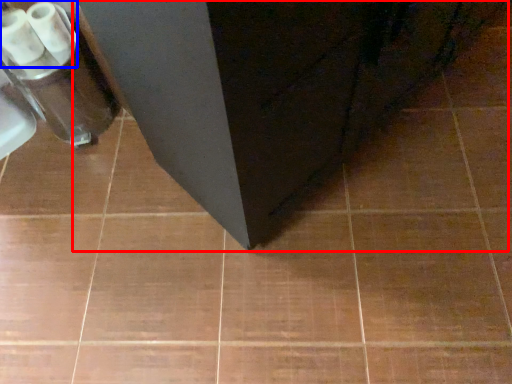
Question: Which object appears closest to the camera in this image, furniture (highlighted by a red box) or toilet paper (highlighted by a blue box)?

Choices:
 (A) furniture
 (B) toilet paper

Answer: (A)